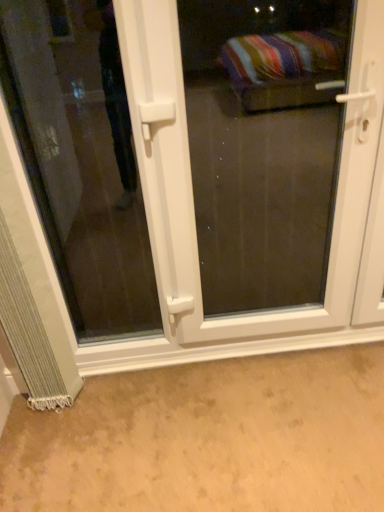
Identify the location of silvery textured curtain at lower left. The width and height of the screenshot is (384, 512). (27, 332).

I want to click on white plastic door at center, so click(x=201, y=170).

Describe the element at coordinates (201, 170) in the screenshot. The image size is (384, 512). I see `white plastic door at center` at that location.

The image size is (384, 512). What are the coordinates of `transparent glass door at lower left` in the screenshot? It's located at (81, 160).

Image resolution: width=384 pixels, height=512 pixels. I want to click on silvery textured curtain at lower left, so click(x=27, y=332).

The image size is (384, 512). In order to click on door below the transparent glass door at lower left (from a real-world perspective) in this screenshot , I will do `click(201, 170)`.

Does transparent glass door at lower left appear on the right side of white plastic door at center?

In fact, transparent glass door at lower left is to the left of white plastic door at center.

Is transparent glass door at lower left shorter than white plastic door at center?

Indeed, transparent glass door at lower left has a lesser height compared to white plastic door at center.

Considering the relative sizes of transparent glass door at lower left and white plastic door at center in the image provided, is transparent glass door at lower left thinner than white plastic door at center?

Yes, transparent glass door at lower left is thinner than white plastic door at center.

In the scene shown: Is white plastic door at center positioned before silvery textured curtain at lower left?

Yes, white plastic door at center is closer to the viewer.

Is white plastic door at center aimed at silvery textured curtain at lower left?

Yes, white plastic door at center is facing silvery textured curtain at lower left.

From the picture: What's the angular difference between white plastic door at center and silvery textured curtain at lower left's facing directions?

The angle between the facing direction of white plastic door at center and the facing direction of silvery textured curtain at lower left is 0.321 degrees.

Is white plastic door at center taller than silvery textured curtain at lower left?

Correct, white plastic door at center is much taller as silvery textured curtain at lower left.

Is point (380, 213) closer or farther from the camera than point (45, 53)?

Point (380, 213) appears to be closer to the viewer than point (45, 53).

In the image, there is a transparent glass door at lower left. Where is `door below it (from a real-world perspective)`? door below it (from a real-world perspective) is located at coordinates (201, 170).

From the image's perspective, which one is positioned higher, white plastic door at center or transparent glass door at lower left?

transparent glass door at lower left.

Which of these two, white plastic door at center or transparent glass door at lower left, is wider?

Wider between the two is white plastic door at center.

Which of these two, transparent glass door at lower left or silvery textured curtain at lower left, is bigger?

Bigger between the two is transparent glass door at lower left.

Can you confirm if transparent glass door at lower left is positioned to the left of silvery textured curtain at lower left?

No, transparent glass door at lower left is not to the left of silvery textured curtain at lower left.

Consider the image. From a real-world perspective, is transparent glass door at lower left physically above silvery textured curtain at lower left?

Correct, in the physical world, transparent glass door at lower left is higher than silvery textured curtain at lower left.

From the image's perspective, which one is positioned lower, silvery textured curtain at lower left or transparent glass door at lower left?

From the image's view, silvery textured curtain at lower left is below.

Considering the relative positions of silvery textured curtain at lower left and transparent glass door at lower left in the image provided, is silvery textured curtain at lower left in front of transparent glass door at lower left?

No, silvery textured curtain at lower left is behind transparent glass door at lower left.

Is silvery textured curtain at lower left next to transparent glass door at lower left?

No.

Where is `window on the right of silvery textured curtain at lower left`? window on the right of silvery textured curtain at lower left is located at coordinates click(x=81, y=160).

Consider the image. Relative to white plastic door at center, is silvery textured curtain at lower left in front or behind?

silvery textured curtain at lower left is behind white plastic door at center.

Which object is thinner, silvery textured curtain at lower left or white plastic door at center?

With smaller width is white plastic door at center.

Is point (54, 372) positioned in front of point (213, 321)?

Yes.

Between silvery textured curtain at lower left and white plastic door at center, which one has less height?

With less height is silvery textured curtain at lower left.

You are a GUI agent. You are given a task and a screenshot of the screen. Output one action in this format:
    pyautogui.click(x=<x>, y=<y>)
    Task: Click on the window above the white plastic door at center (from a real-world perspective)
    This screenshot has height=512, width=384.
    Given the screenshot: What is the action you would take?
    pyautogui.click(x=81, y=160)

Find the location of a particular element. Image resolution: width=384 pixels, height=512 pixels. door that appears above the silvery textured curtain at lower left (from the image's perspective) is located at coordinates (201, 170).

Considering their positions, is white plastic door at center positioned closer to transparent glass door at lower left than silvery textured curtain at lower left?

Based on the image, white plastic door at center appears to be nearer to transparent glass door at lower left.

From the image, which object appears to be farther from silvery textured curtain at lower left, transparent glass door at lower left or white plastic door at center?

transparent glass door at lower left.

Which object lies further to the anchor point white plastic door at center, transparent glass door at lower left or silvery textured curtain at lower left?

silvery textured curtain at lower left is positioned further to the anchor white plastic door at center.

Considering their positions, is silvery textured curtain at lower left positioned further to white plastic door at center than transparent glass door at lower left?

Based on the image, silvery textured curtain at lower left appears to be further to white plastic door at center.

From the image, which object appears to be nearer to silvery textured curtain at lower left, white plastic door at center or transparent glass door at lower left?

Among the two, white plastic door at center is located nearer to silvery textured curtain at lower left.

Which object lies nearer to the anchor point transparent glass door at lower left, silvery textured curtain at lower left or white plastic door at center?

white plastic door at center lies closer to transparent glass door at lower left than the other object.

This screenshot has height=512, width=384. Find the location of `window between silvery textured curtain at lower left and white plastic door at center`. window between silvery textured curtain at lower left and white plastic door at center is located at coordinates (81, 160).